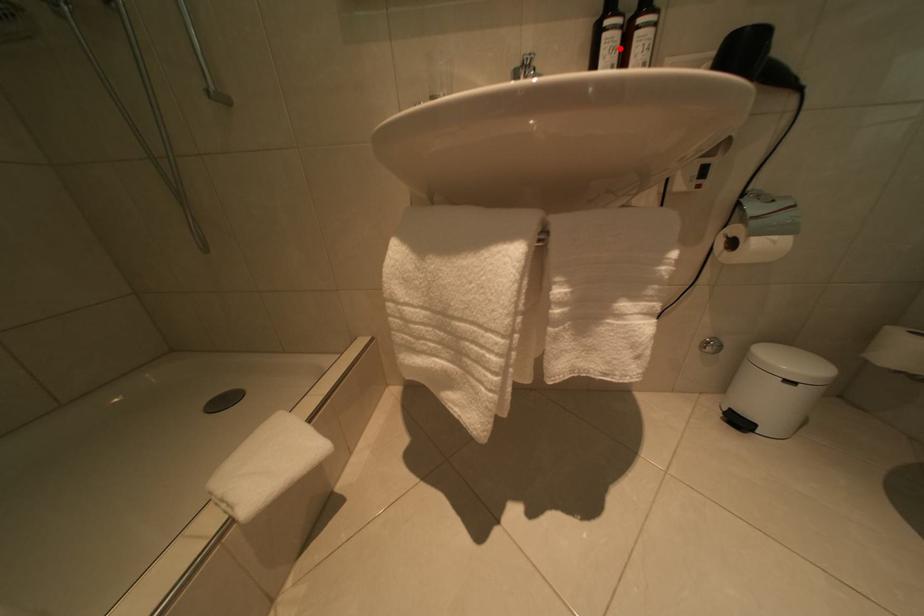
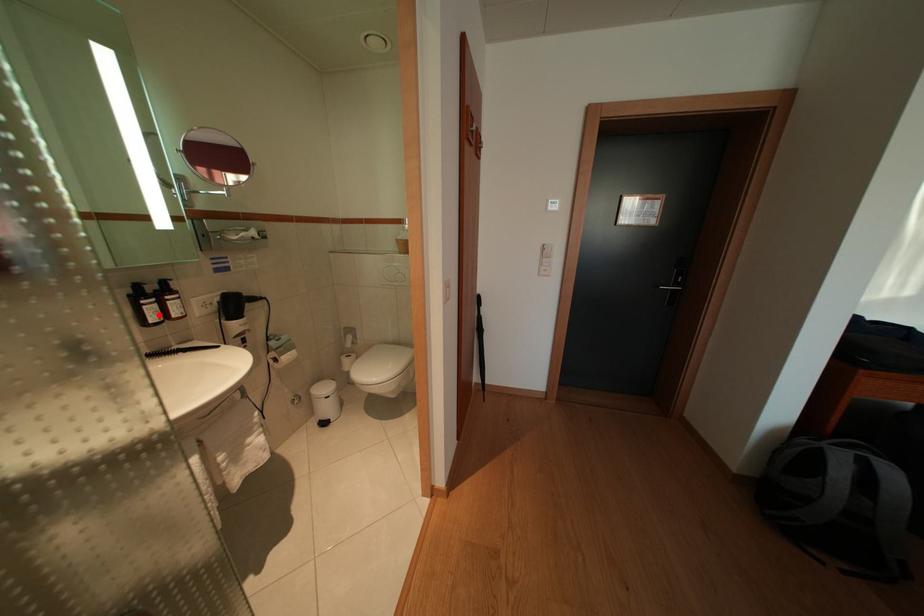
I am providing you with two images of the same scene from different viewpoints. A red point is marked on the first image and another point is marked on the second image. Do the highlighted points in image1 and image2 indicate the same real-world spot?

Yes